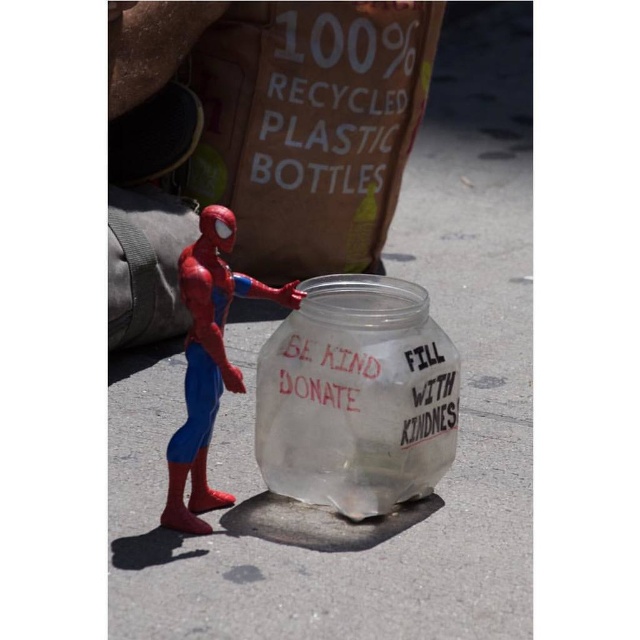
Question: Can you confirm if transparent plastic jar at center is bigger than shiny plastic spider-man at center?

Choices:
 (A) yes
 (B) no

Answer: (B)

Question: Which object is closer to the camera taking this photo?

Choices:
 (A) transparent plastic jar at center
 (B) shiny plastic spider-man at center

Answer: (B)

Question: Which object appears farthest from the camera in this image?

Choices:
 (A) transparent plastic jar at center
 (B) shiny plastic spider-man at center

Answer: (A)

Question: Which point is farther from the camera taking this photo?

Choices:
 (A) (234, 285)
 (B) (324, 403)

Answer: (B)

Question: Can you confirm if transparent plastic jar at center is positioned to the right of shiny plastic spider-man at center?

Choices:
 (A) no
 (B) yes

Answer: (B)

Question: Does transparent plastic jar at center have a lesser width compared to shiny plastic spider-man at center?

Choices:
 (A) no
 (B) yes

Answer: (A)